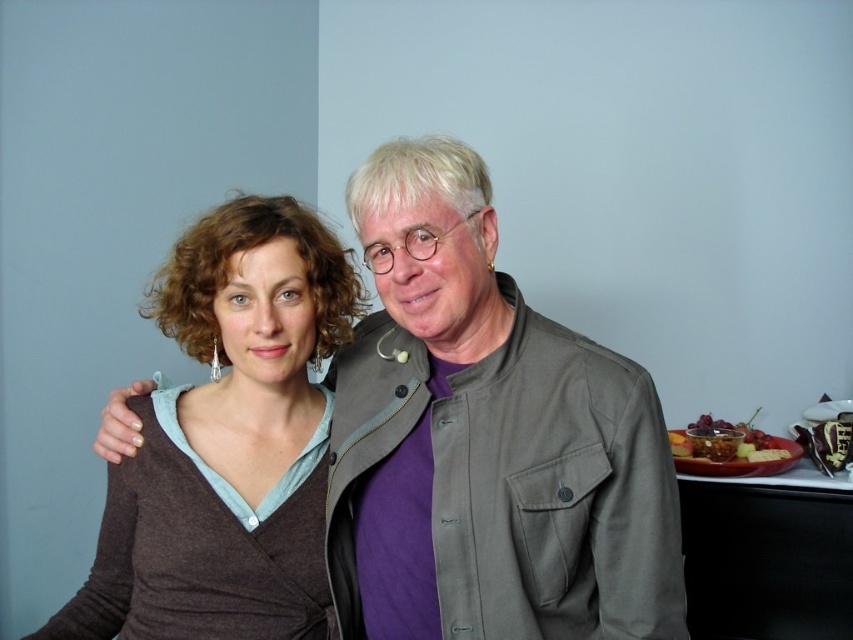
Question: Does matte gray jacket at center come in front of brown matte sweater at center?

Choices:
 (A) no
 (B) yes

Answer: (B)

Question: Can you confirm if matte gray jacket at center is bigger than brown matte sweater at center?

Choices:
 (A) no
 (B) yes

Answer: (B)

Question: Does matte gray jacket at center lie in front of brown matte sweater at center?

Choices:
 (A) yes
 (B) no

Answer: (A)